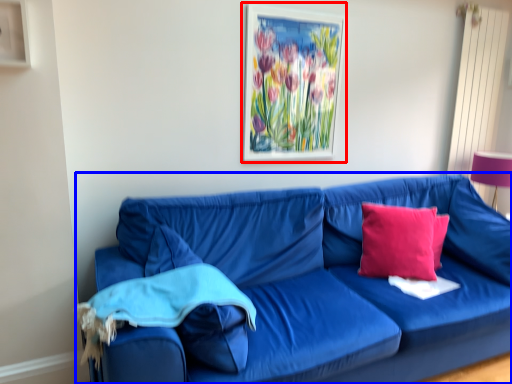
Question: Which object appears farthest to the camera in this image, picture frame (highlighted by a red box) or studio couch (highlighted by a blue box)?

Choices:
 (A) picture frame
 (B) studio couch

Answer: (A)